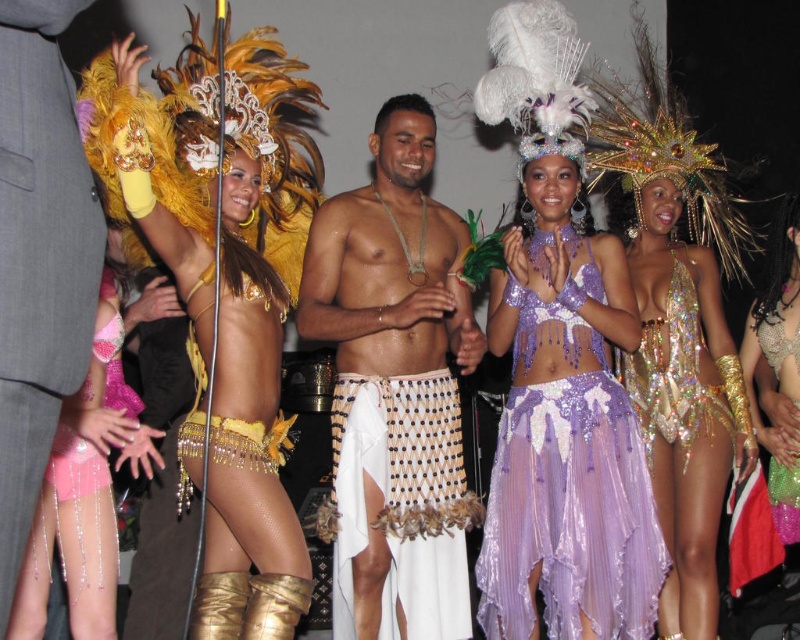
Question: Which is farther from the sequined gold dress at center?

Choices:
 (A) shiny sequined top at center
 (B) pink sequined shorts at lower left

Answer: (B)

Question: Can you confirm if purple sequined dress at center is smaller than holographic sequin bodysuit at center?

Choices:
 (A) no
 (B) yes

Answer: (A)

Question: Considering the real-world distances, which object is closest to the shiny sequined top at center?

Choices:
 (A) purple sequined dress at center
 (B) pink sequined shorts at lower left

Answer: (A)

Question: Can you confirm if purple sequined dress at center is positioned to the left of pink sequined shorts at lower left?

Choices:
 (A) no
 (B) yes

Answer: (A)

Question: Observing the image, what is the correct spatial positioning of purple sequined dress at center in reference to shiny sequined top at center?

Choices:
 (A) left
 (B) right

Answer: (A)

Question: Considering the real-world distances, which object is closest to the holographic sequin top at center?

Choices:
 (A) shiny gold skirt at center
 (B) pink sequined shorts at lower left

Answer: (A)